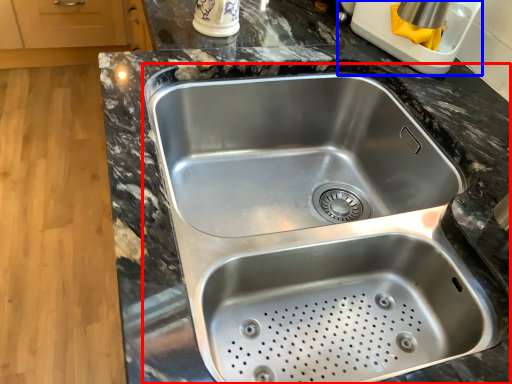
Question: Which of the following is the farthest to the observer, sink (highlighted by a red box) or appliance (highlighted by a blue box)?

Choices:
 (A) sink
 (B) appliance

Answer: (B)